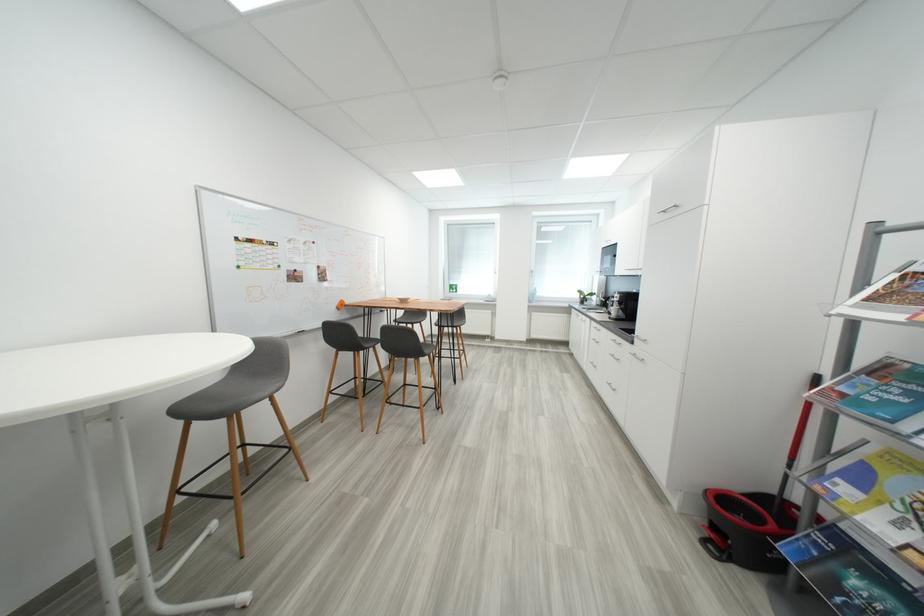
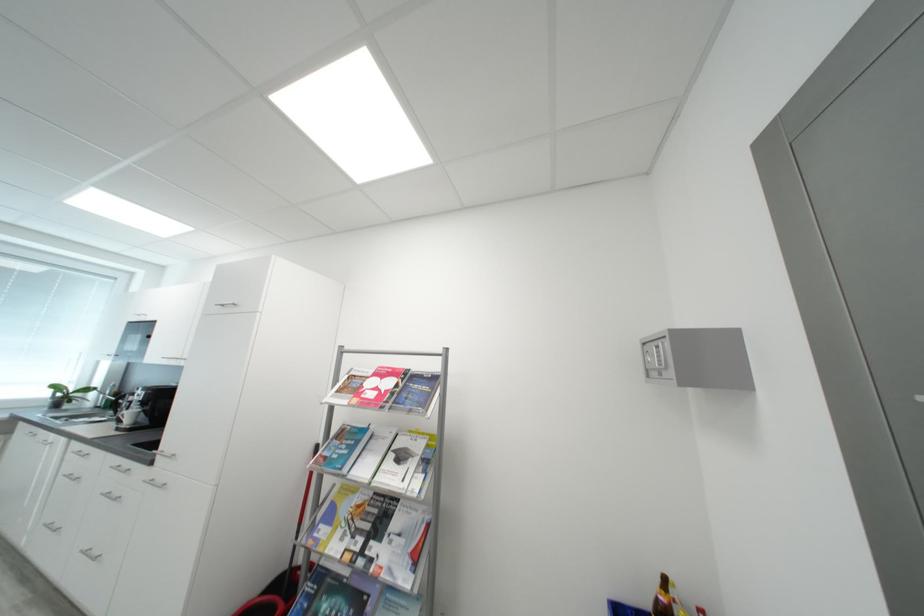
Find the pixel in the second image that matches point (587, 294) in the first image.

(62, 389)